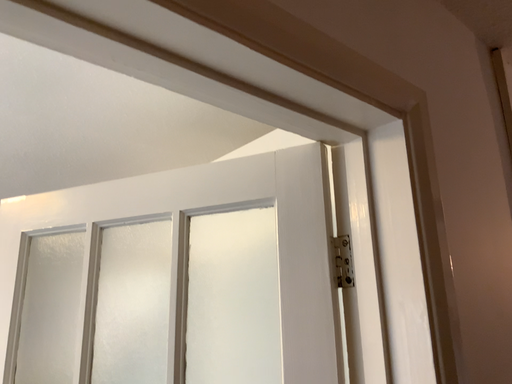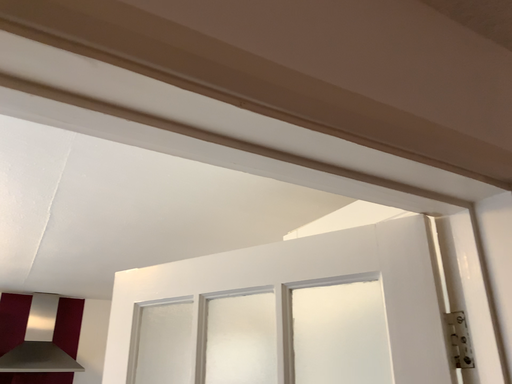
Question: Which way did the camera rotate in the video?

Choices:
 (A) rotated right
 (B) rotated left

Answer: (B)